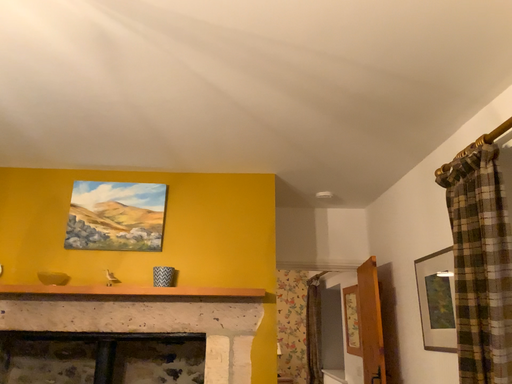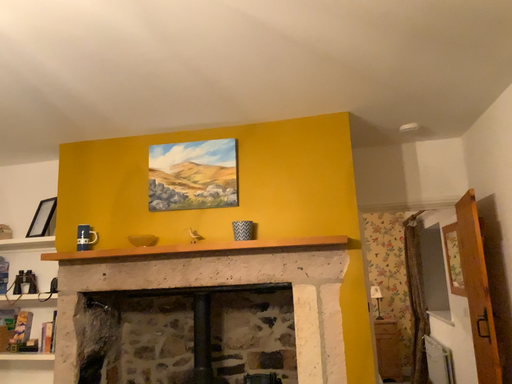
Question: Which way did the camera rotate in the video?

Choices:
 (A) rotated downward
 (B) rotated upward

Answer: (A)